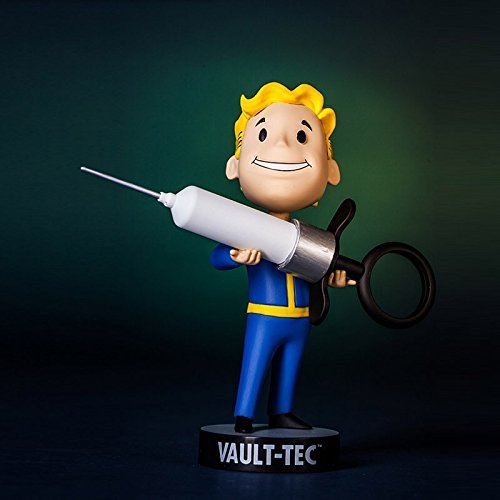
The height and width of the screenshot is (500, 500). Find the location of `toy person statue`. toy person statue is located at coordinates (290, 123).